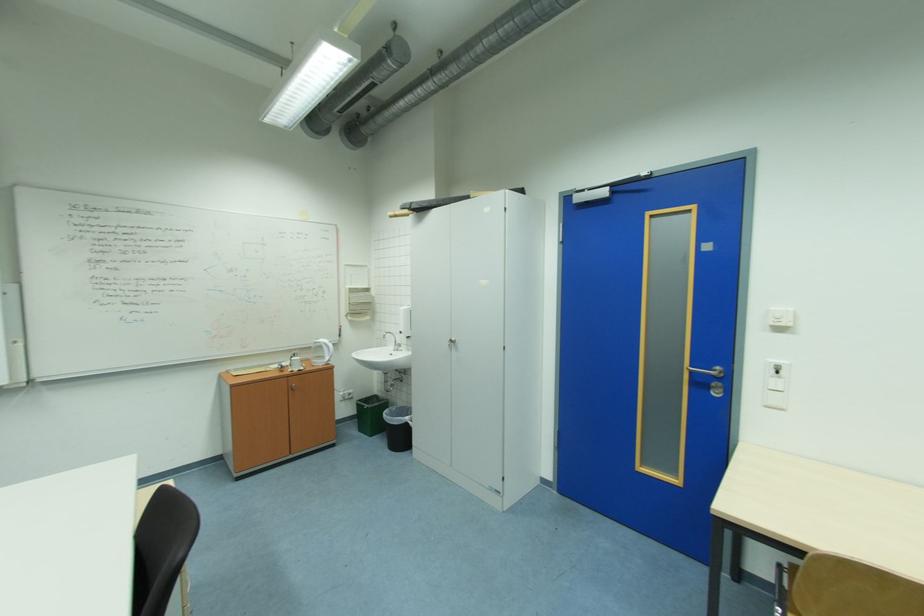
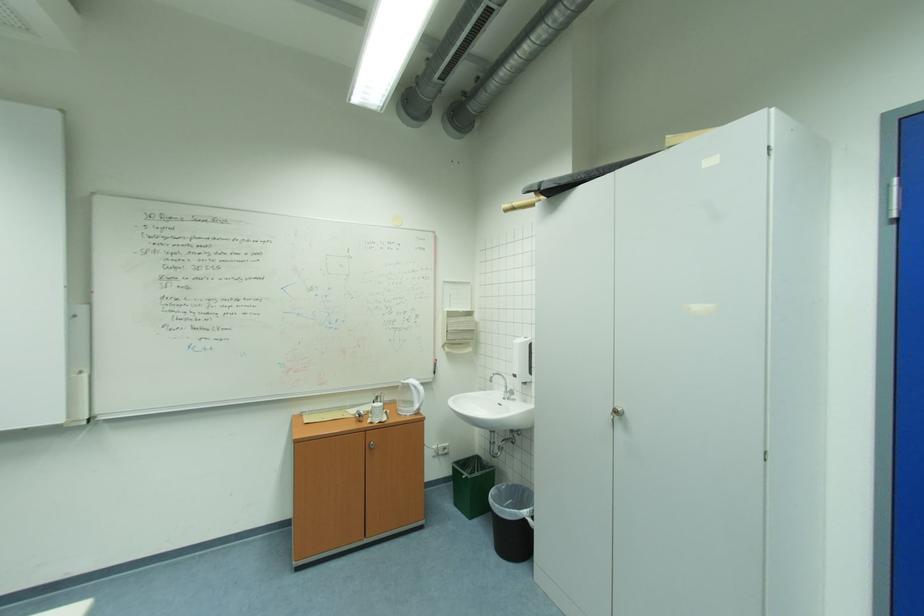
In the second image, find the point that corresponds to point (327, 363) in the first image.

(415, 411)